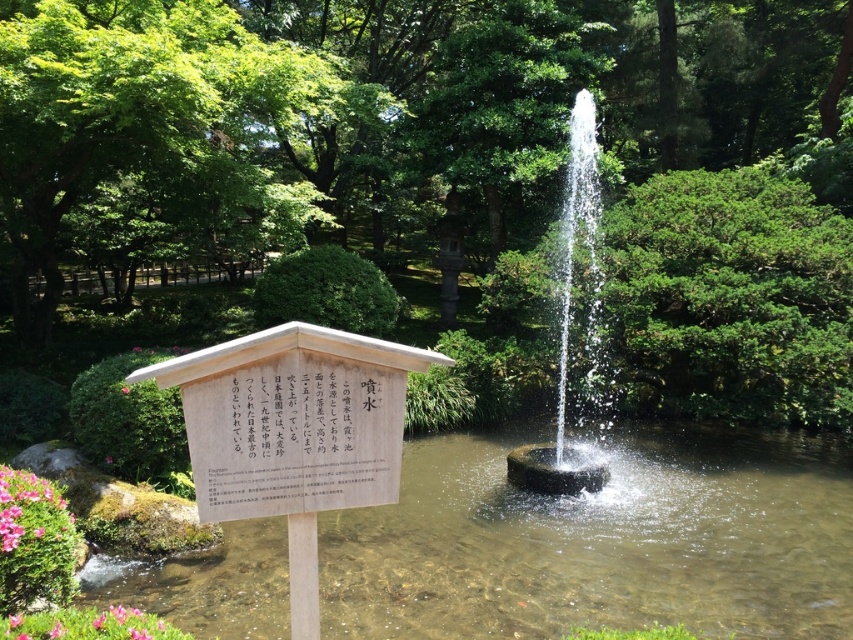
Does clear water fountain at center have a larger size compared to pink matte flower at lower left?

Actually, clear water fountain at center might be smaller than pink matte flower at lower left.

Does clear water fountain at center have a lesser width compared to pink matte flower at lower left?

Correct, clear water fountain at center's width is less than pink matte flower at lower left's.

The height and width of the screenshot is (640, 853). What do you see at coordinates (573, 326) in the screenshot?
I see `clear water fountain at center` at bounding box center [573, 326].

What are the coordinates of `clear water fountain at center` in the screenshot? It's located at (573, 326).

Looking at this image, who is positioned more to the right, green leafy tree at center or clear water fountain at center?

clear water fountain at center is more to the right.

Is green leafy tree at center shorter than clear water fountain at center?

Incorrect, green leafy tree at center's height does not fall short of clear water fountain at center's.

You are a GUI agent. You are given a task and a screenshot of the screen. Output one action in this format:
    pyautogui.click(x=<x>, y=<y>)
    Task: Click on the green leafy tree at center
    The height and width of the screenshot is (640, 853).
    Given the screenshot: What is the action you would take?
    pyautogui.click(x=396, y=99)

Does white paper sign at center lie behind clear water fountain at center?

No.

Locate an element on the screen. white paper sign at center is located at coordinates (296, 440).